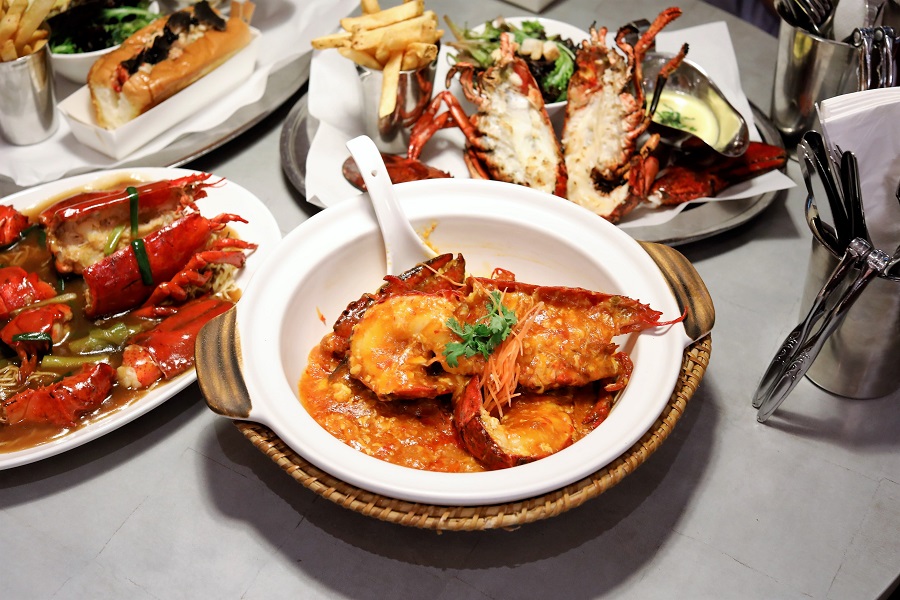
Where is `bowl`? The width and height of the screenshot is (900, 600). bowl is located at coordinates (262, 306).